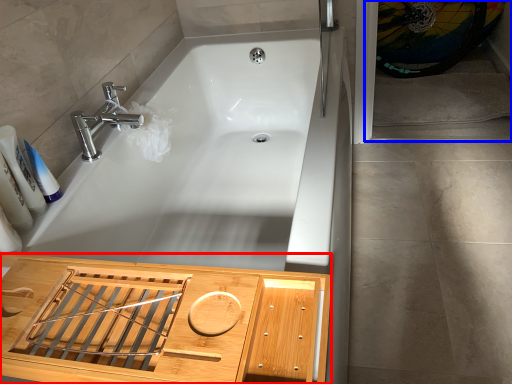
Question: Among these objects, which one is nearest to the camera, cabinetry (highlighted by a red box) or screen door (highlighted by a blue box)?

Choices:
 (A) cabinetry
 (B) screen door

Answer: (A)